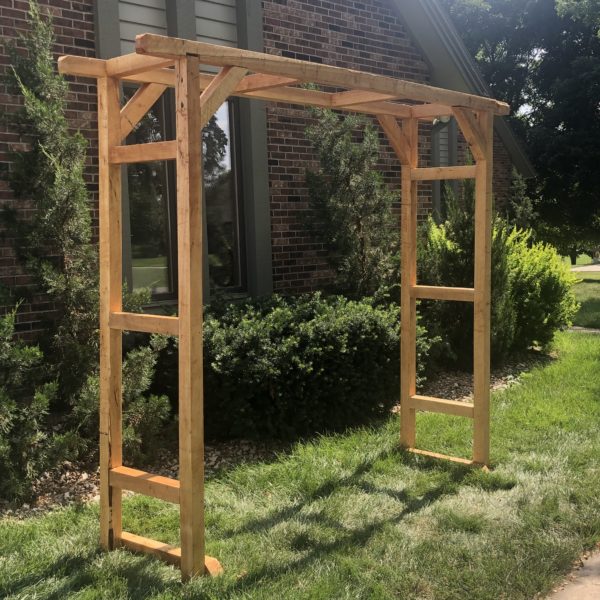
The width and height of the screenshot is (600, 600). Identify the location of shutters. (131, 17), (216, 30).